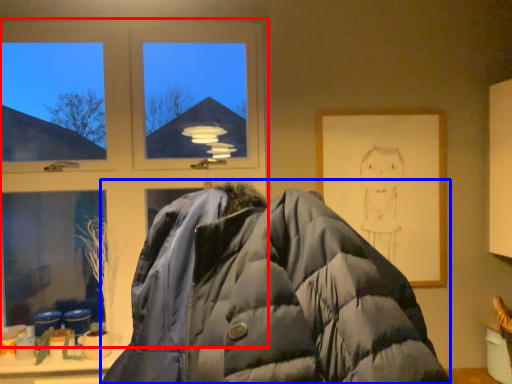
Question: Which object appears closest to the camera in this image, window (highlighted by a red box) or jacket (highlighted by a blue box)?

Choices:
 (A) window
 (B) jacket

Answer: (B)